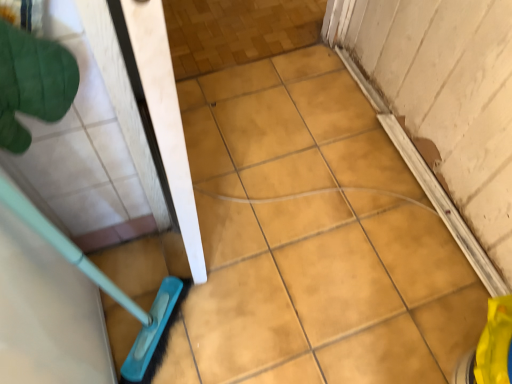
Locate an element on the screen. This screenshot has width=512, height=384. vacant area to the left of yellow matte tile at lower right, which appears as the 2th ceramic tile when viewed from the left is located at coordinates (378, 321).